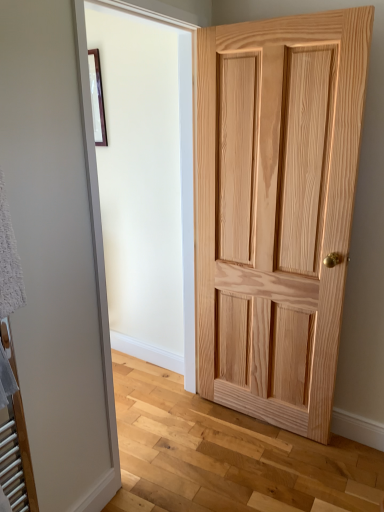
This screenshot has width=384, height=512. In order to click on free spot in front of natural wood door at right in this screenshot , I will do `click(263, 467)`.